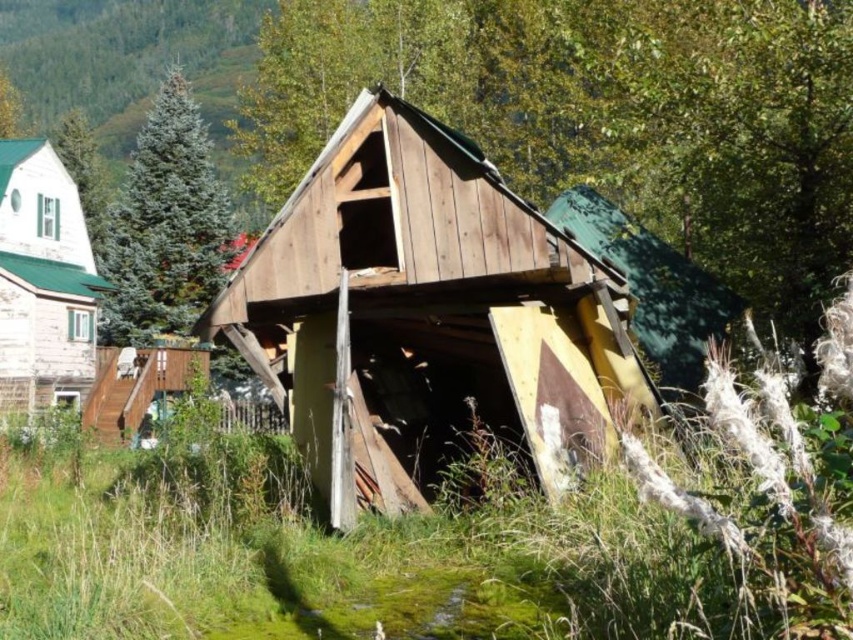
Question: Which object appears closest to the camera in this image?

Choices:
 (A) brown wood at center
 (B) green fir tree at upper left
 (C) green shingles cabin at left

Answer: (A)

Question: Which object is farther from the camera taking this photo?

Choices:
 (A) brown wood at center
 (B) green shingles cabin at left
 (C) wooden barn at center

Answer: (B)

Question: Does wooden barn at center appear on the right side of green shingles cabin at left?

Choices:
 (A) yes
 (B) no

Answer: (A)

Question: Does brown wood at center have a larger size compared to wooden barn at center?

Choices:
 (A) yes
 (B) no

Answer: (A)

Question: Can you confirm if brown wood at center is positioned to the left of green shingles cabin at left?

Choices:
 (A) yes
 (B) no

Answer: (B)

Question: Which object is positioned farthest from the brown wood at center?

Choices:
 (A) wooden barn at center
 (B) green fir tree at upper left
 (C) green shingles cabin at left

Answer: (A)